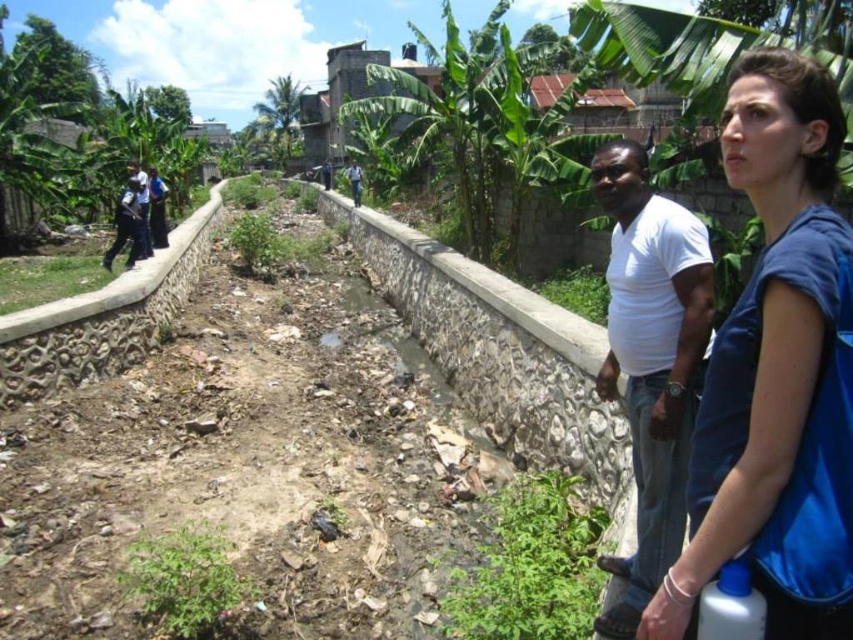
You are standing at the edge of the waterway and want to walk to the point marked as point (322, 164). However, there is a fence blocking your path. The fence is located at point (654, 579). Can you go around the fence to reach your destination?

Point (654, 579) is closer to the viewer than point (322, 164). Since the fence is at the closer point, you can walk around it to reach the farther point (322, 164).

You are a pedestrian walking along the waterway and notice two people wearing dark blue clothing. The dark blue uniform at upper left and the dark blue shirt at center are both visible. Which person is closer to the waterway?

The dark blue uniform at upper left is positioned under the dark blue shirt at center, meaning it is closer to the viewer. Since you are walking along the waterway, the dark blue uniform at upper left would be closer to the waterway than the dark blue shirt at center.